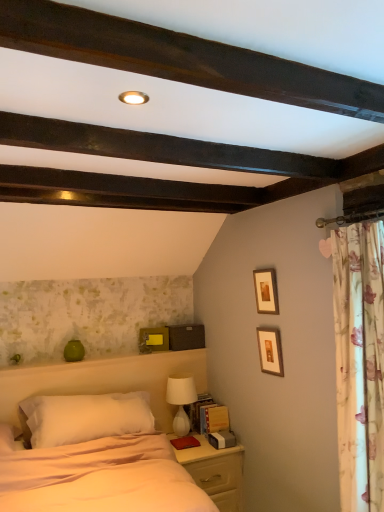
Question: Relative to white soft bed at center, is light wood nightstand at lower right in front or behind?

Choices:
 (A) front
 (B) behind

Answer: (B)

Question: From the image's perspective, is light wood nightstand at lower right above or below white soft bed at center?

Choices:
 (A) below
 (B) above

Answer: (A)

Question: Estimate the real-world distances between objects in this image. Which object is closer to the light wood nightstand at lower right?

Choices:
 (A) yellow matte picture frame at upper center, which is the 3th picture frame in top-to-bottom order
 (B) wooden picture frame at upper center, acting as the third picture frame starting from the bottom
 (C) wooden picture frame at upper right, placed as the first picture frame when sorted from front to back
 (D) white soft bed at center
 (E) floral fabric curtain at right

Answer: (D)

Question: Based on their relative distances, which object is nearer to the white glossy table lamp at lower center?

Choices:
 (A) floral fabric curtain at right
 (B) yellow matte picture frame at upper center, arranged as the 1th picture frame when viewed from the back
 (C) light wood nightstand at lower right
 (D) wooden picture frame at upper center, acting as the third picture frame starting from the bottom
 (E) white soft pillow at center

Answer: (C)